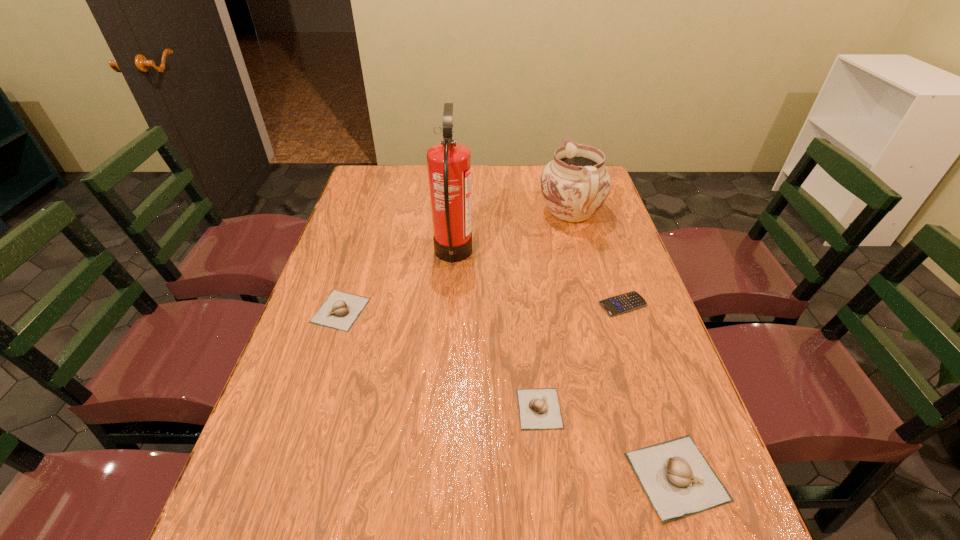
At what (x,y) coordinates should I click in order to perform the action: click on vacant space at the far left corner. Please return your answer as a coordinate pair (x, y). Looking at the image, I should click on (392, 177).

The image size is (960, 540). I want to click on vacant point at the near left corner, so pos(230,500).

This screenshot has height=540, width=960. In order to click on free space between the calculator and the fifth tallest object in this screenshot , I will do `click(581, 356)`.

Where is `free space between the nearest object and the second nearest garlic`? The width and height of the screenshot is (960, 540). free space between the nearest object and the second nearest garlic is located at coordinates (608, 442).

Locate an element on the screen. The width and height of the screenshot is (960, 540). free space between the tallest garlic and the fifth object from right to left is located at coordinates (564, 366).

Locate an element on the screen. Image resolution: width=960 pixels, height=540 pixels. free space between the nearest object and the calculator is located at coordinates (650, 390).

The height and width of the screenshot is (540, 960). Find the location of `free point between the fifth farthest object and the rightmost garlic`. free point between the fifth farthest object and the rightmost garlic is located at coordinates (608, 442).

At what (x,y) coordinates should I click in order to perform the action: click on free area in between the nearest garlic and the calculator. Please return your answer as a coordinate pair (x, y). The height and width of the screenshot is (540, 960). Looking at the image, I should click on (650, 390).

Identify the location of free space between the rightmost garlic and the leftmost object. Image resolution: width=960 pixels, height=540 pixels. (509, 394).

What are the coordinates of `vacant space that is in between the tallest object and the calculator` in the screenshot? It's located at pyautogui.click(x=538, y=280).